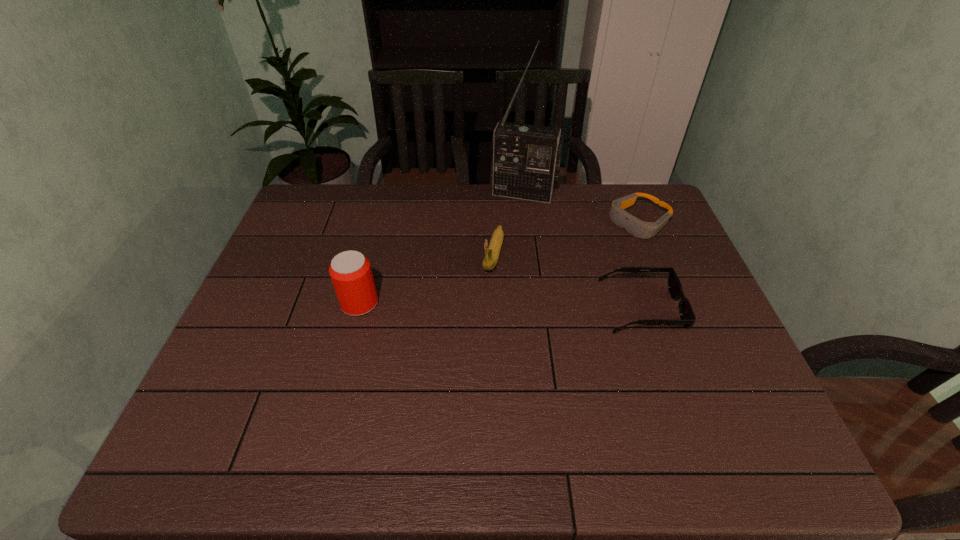
Identify the location of free space located on the display of the farthest object. (492, 279).

The height and width of the screenshot is (540, 960). What are the coordinates of `free space located on the display of the farthest object` in the screenshot? It's located at (508, 231).

Where is `free space located at the stem of the third shortest object`? free space located at the stem of the third shortest object is located at coordinates (466, 363).

Where is `free space located at the stem of the third shortest object`? The image size is (960, 540). free space located at the stem of the third shortest object is located at coordinates (485, 299).

The image size is (960, 540). Find the location of `vacant space located 0.110m at the stem of the third shortest object`. vacant space located 0.110m at the stem of the third shortest object is located at coordinates (483, 307).

The height and width of the screenshot is (540, 960). Find the location of `vacant space located on the front and back of the goggles`. vacant space located on the front and back of the goggles is located at coordinates coord(600,245).

In order to click on free spot located on the front and back of the goggles in this screenshot , I will do `click(550, 274)`.

Find the location of a particular element. This screenshot has width=960, height=540. vacant space positioned 0.050m on the front and back of the goggles is located at coordinates (610, 240).

Locate an element on the screen. radio receiver that is at the far edge is located at coordinates [x=526, y=158].

At what (x,y) coordinates should I click in order to perform the action: click on goggles at the far edge. Please return your answer as a coordinate pair (x, y). Looking at the image, I should click on (641, 229).